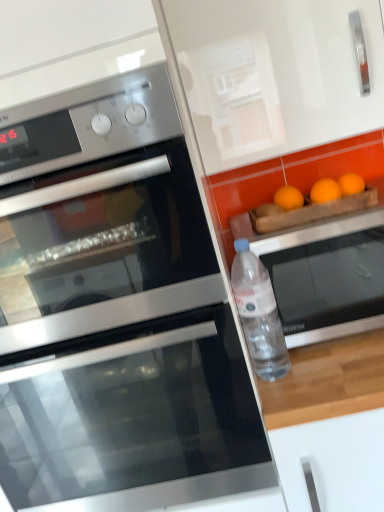
This screenshot has height=512, width=384. Find the location of `vacant space in front of transparent plastic bottle at right`. vacant space in front of transparent plastic bottle at right is located at coordinates coord(292,393).